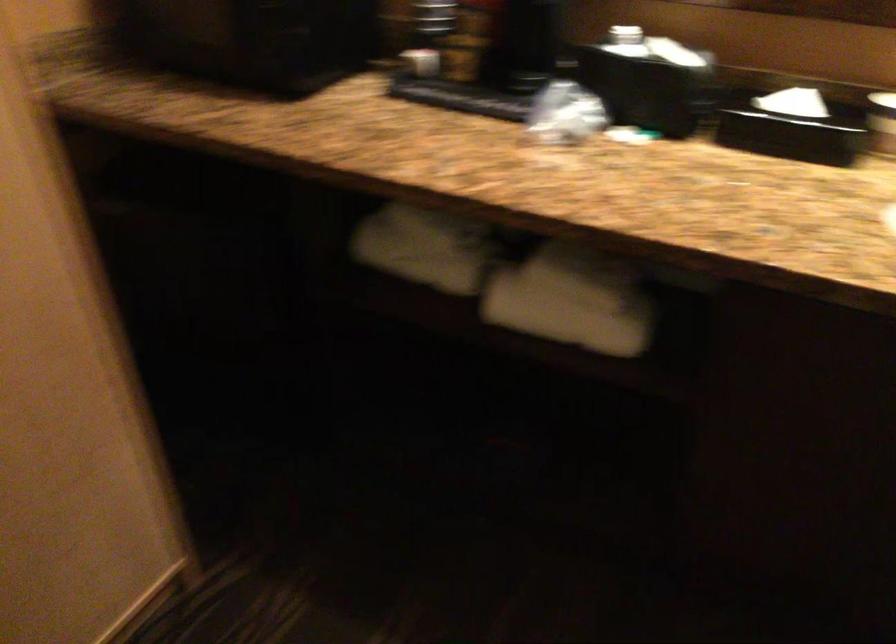
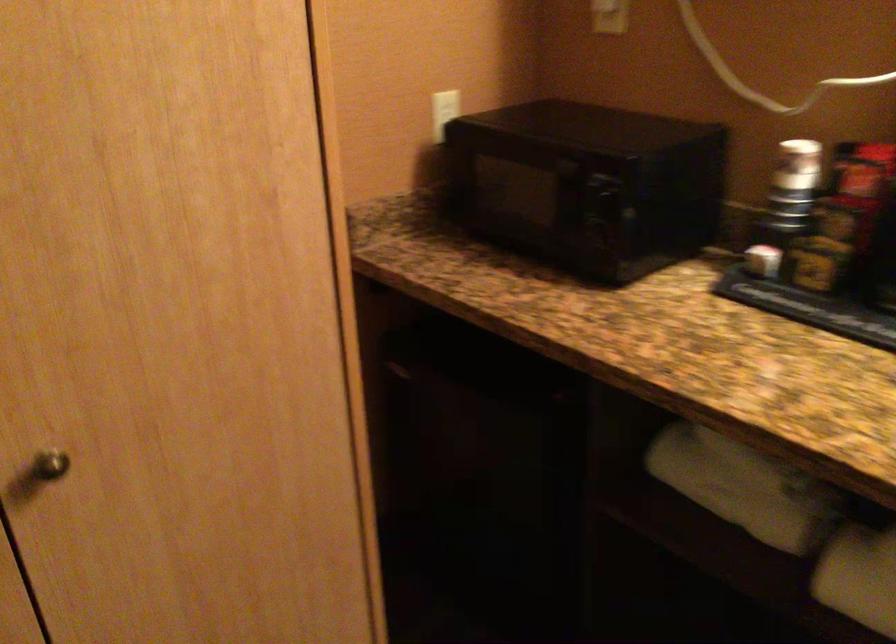
Locate, in the second image, the point that corresponds to pixel 517 301 in the first image.

(858, 576)